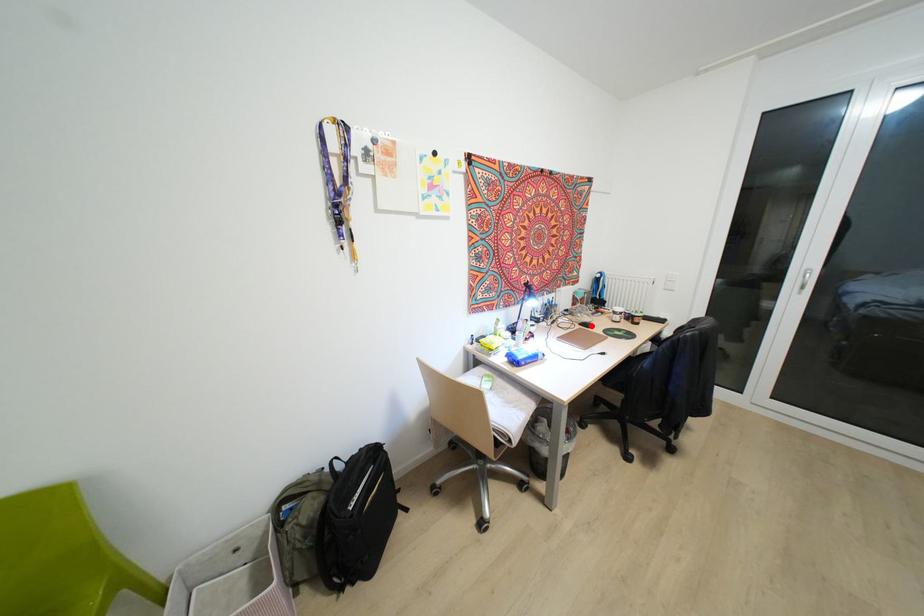
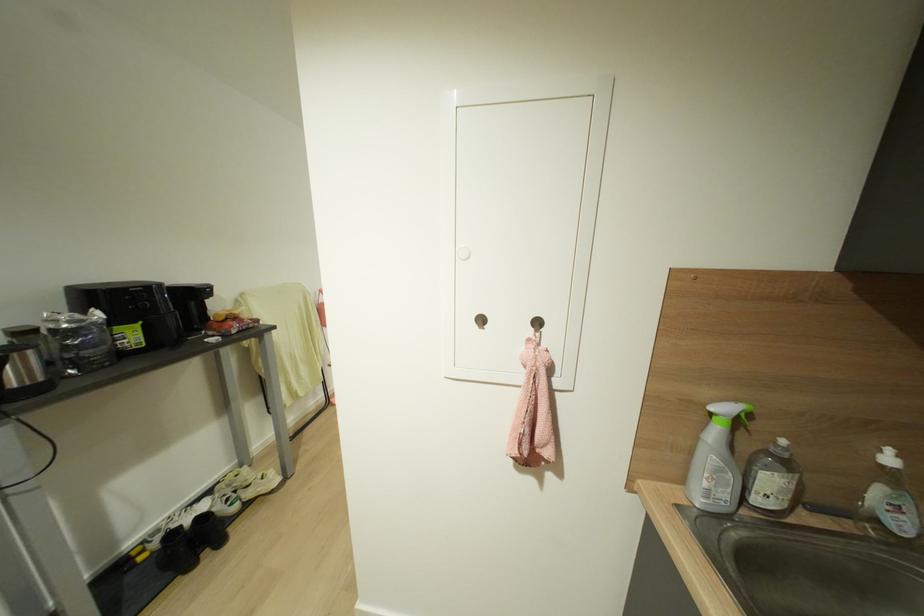
Question: I am providing you with two images of the same scene from different viewpoints. A red point is marked on the first image. Is the red point's position out of view in image 2?

Choices:
 (A) Yes
 (B) No

Answer: (A)